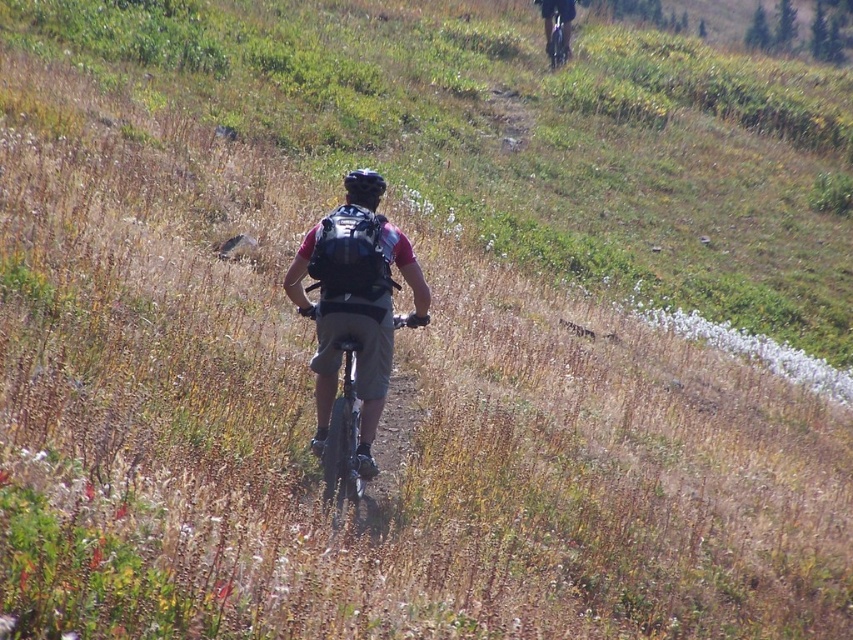
Between matte black backpack at center and matte black backpack at upper center, which one has less height?

Standing shorter between the two is matte black backpack at center.

Between matte black backpack at center and matte black backpack at upper center, which one has more height?

With more height is matte black backpack at upper center.

Describe the element at coordinates (354, 310) in the screenshot. I see `matte black backpack at center` at that location.

I want to click on matte black backpack at center, so click(354, 310).

Is matte black backpack at center further to the viewer compared to metallic silver bicycle at center?

Yes, it is behind metallic silver bicycle at center.

Does point (293, 301) come behind point (341, 428)?

That is True.

You are a GUI agent. You are given a task and a screenshot of the screen. Output one action in this format:
    pyautogui.click(x=<x>, y=<y>)
    Task: Click on the matte black backpack at center
    
    Given the screenshot: What is the action you would take?
    pyautogui.click(x=354, y=310)

Is matte black backpack at center to the left of matte black helmet at center from the viewer's perspective?

In fact, matte black backpack at center is to the right of matte black helmet at center.

Is point (355, 316) less distant than point (350, 173)?

Yes.

Who is more distant from viewer, (x=410, y=314) or (x=380, y=176)?

The point (x=380, y=176) is behind.

Image resolution: width=853 pixels, height=640 pixels. Find the location of `matte black backpack at center`. matte black backpack at center is located at coordinates (354, 310).